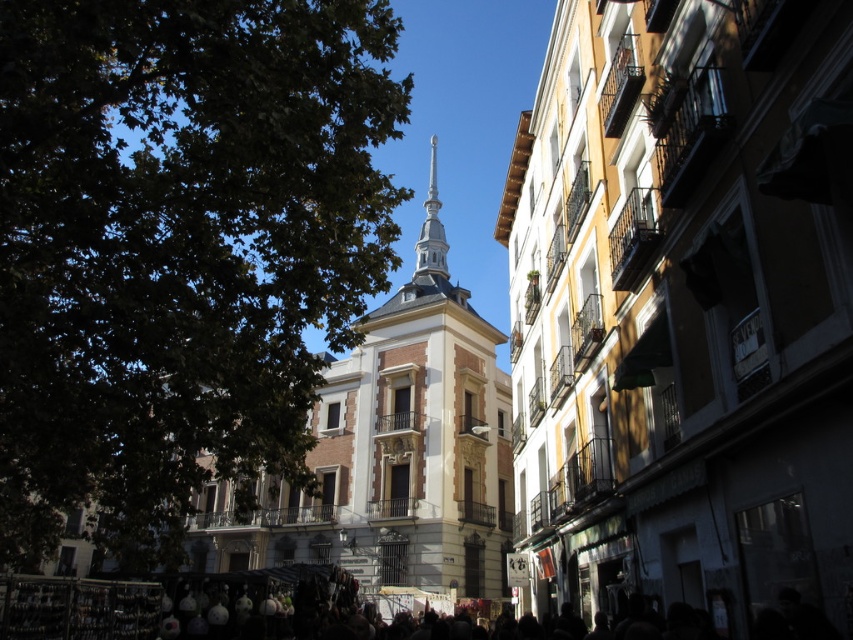
Which of these two, green leafy tree at upper left or white stone tower at center, stands taller?

green leafy tree at upper left

Can you confirm if green leafy tree at upper left is positioned to the right of white stone tower at center?

Incorrect, green leafy tree at upper left is not on the right side of white stone tower at center.

Measure the distance between green leafy tree at upper left and camera.

green leafy tree at upper left and camera are 37.79 meters apart from each other.

Locate an element on the screen. The image size is (853, 640). green leafy tree at upper left is located at coordinates 178,246.

Who is lower down, white stone tower at center or smooth silver spire at center?

white stone tower at center is below.

Which is in front, point (422, 394) or point (434, 141)?

Positioned in front is point (422, 394).

Does point (419, 488) lie behind point (426, 221)?

No.

Find the location of `white stone tower at center`. white stone tower at center is located at coordinates (393, 464).

Between green leafy tree at upper left and smooth silver spire at center, which one has less height?

smooth silver spire at center

The width and height of the screenshot is (853, 640). Identify the location of green leafy tree at upper left. (178, 246).

Does point (292, 461) lie in front of point (421, 262)?

That is True.

Find the location of `green leafy tree at upper left`. green leafy tree at upper left is located at coordinates (178, 246).